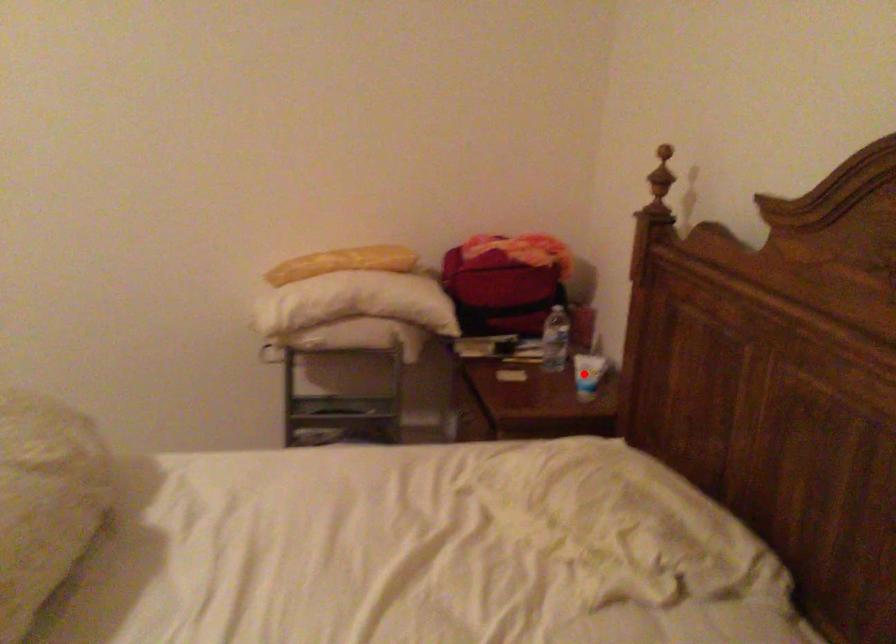
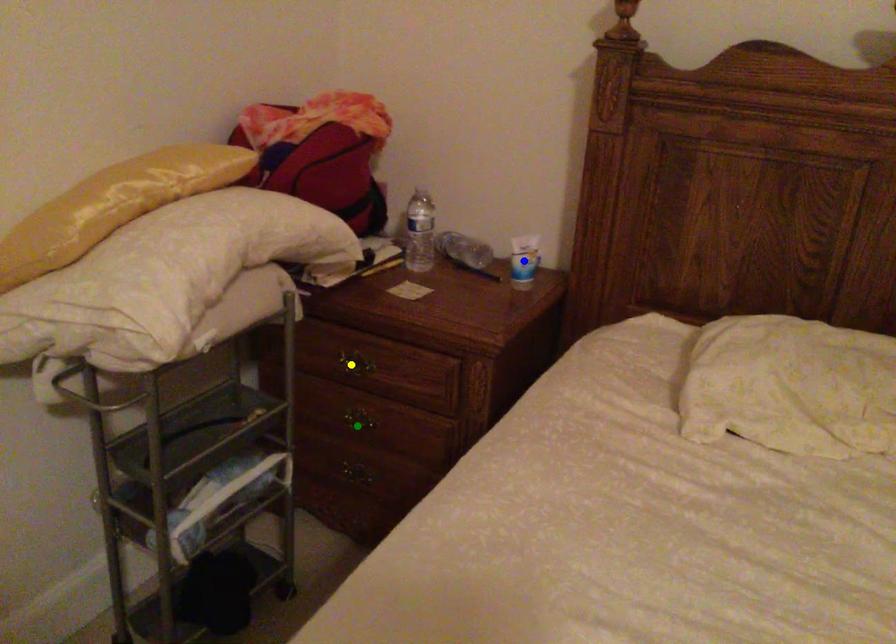
Question: I am providing you with two images of the same scene from different viewpoints. A red point is marked on the first image. You are given multiple points on the second image. Which spot in image 2 lines up with the point in image 1?

Choices:
 (A) green point
 (B) yellow point
 (C) blue point

Answer: (C)